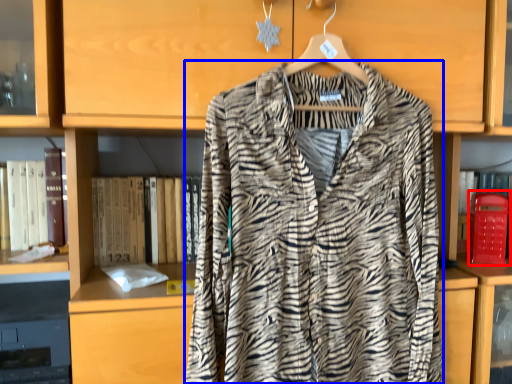
Question: Which object appears farthest to the camera in this image, phone box (highlighted by a red box) or fancy dress (highlighted by a blue box)?

Choices:
 (A) phone box
 (B) fancy dress

Answer: (A)